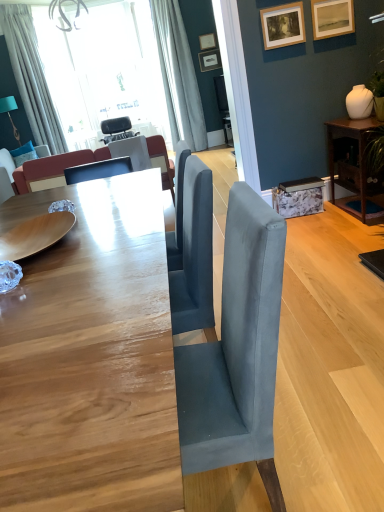
Find the location of `blank space to the left of brown wood table at right, arranged as the second table when ordered from the bottom`. blank space to the left of brown wood table at right, arranged as the second table when ordered from the bottom is located at coordinates (331, 223).